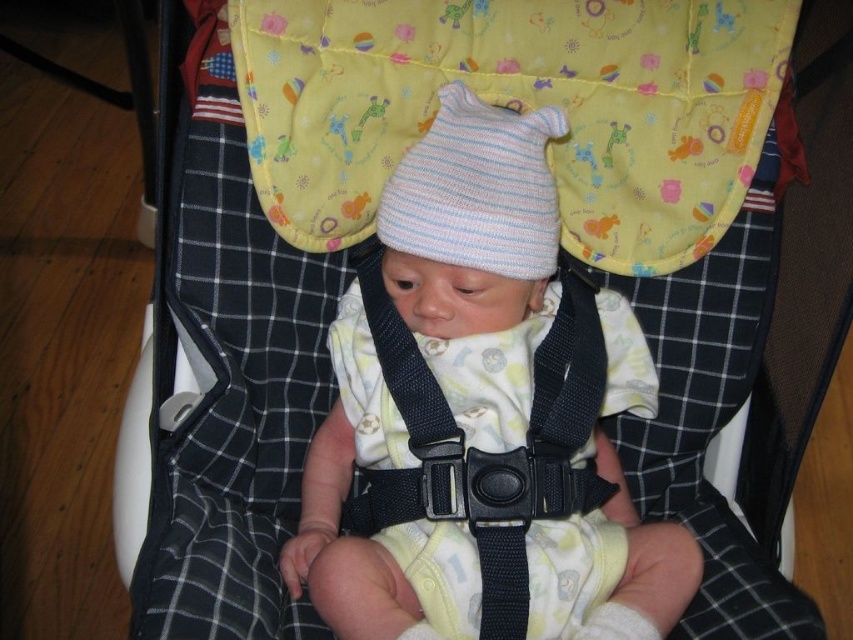
Can you confirm if soft cotton hat at center is smaller than striped knit hat at center?

Incorrect, soft cotton hat at center is not smaller in size than striped knit hat at center.

Based on the photo, who is taller, soft cotton hat at center or striped knit hat at center?

Standing taller between the two is soft cotton hat at center.

Measure the distance between soft cotton hat at center and camera.

soft cotton hat at center and camera are 78.68 centimeters apart.

Find the location of `soft cotton hat at center`. soft cotton hat at center is located at coordinates (476, 257).

Who is more distant from viewer, (x=474, y=520) or (x=527, y=224)?

Point (x=527, y=224)

Does black fabric strap at center have a smaller size compared to striped knit hat at center?

No.

Measure the distance between point (355, 260) and camera.

Point (355, 260) is 1.07 meters away from camera.

What are the coordinates of `black fabric strap at center` in the screenshot? It's located at (486, 451).

Describe the element at coordinates (476, 257) in the screenshot. This screenshot has height=640, width=853. I see `soft cotton hat at center` at that location.

Is soft cotton hat at center closer to the viewer compared to black fabric strap at center?

Yes, it is.

Where is `soft cotton hat at center`? soft cotton hat at center is located at coordinates (476, 257).